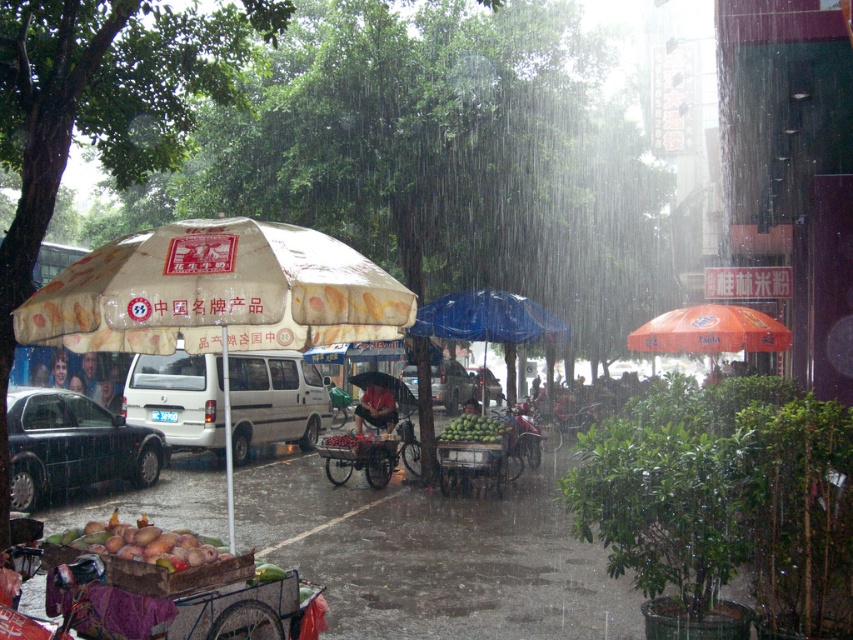
You are a delivery person who needs to park your 1.2 meter wide cart in this scene. The metallic red cart at center is currently occupying a space. Can you park your cart next to it without overlapping?

The metallic red cart at center is located at point (x=366, y=454). Since the coordinates are not provided for available spaces, it is unclear if there is enough space to park the cart next to it without overlapping. More information is needed to determine feasibility.

You are a delivery person standing in the rain and see the metallic red cart at center and the smooth skin face at center. Which object is taller?

The metallic red cart at center is much taller than the smooth skin face at center.

You are a delivery driver who needs to park your vehicle in a narrow alley next to the fruit stall. Your van is the same size as the white matte van at center. Can you fit your van in the space next to the metallic red cart at center without overlapping?

The white matte van at center has a smaller size compared to metallic red cart at center. Since your van is the same size as the white matte van at center, it may still not fit next to the metallic red cart at center if the space is constrained by the cart size.